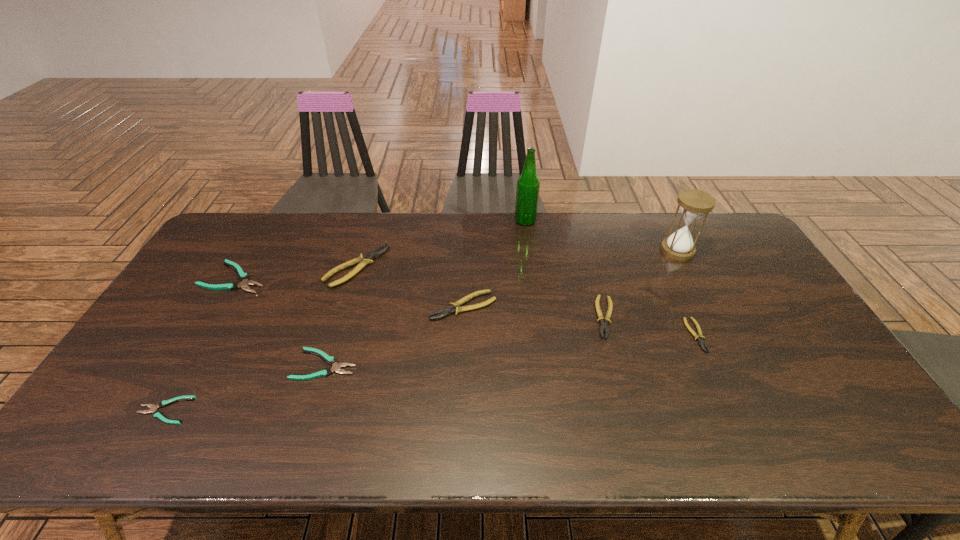
Locate which pliers ranks fourth in proximity to the hourglass. Please provide its 2D coordinates. Your answer should be formatted as a tuple, i.e. [(x, y)], where the tuple contains the x and y coordinates of a point satisfying the conditions above.

[(363, 260)]

You are a GUI agent. You are given a task and a screenshot of the screen. Output one action in this format:
    pyautogui.click(x=<x>, y=<y>)
    Task: Click on the pliers object that ranks as the fifth closest to the shortest object
    Image resolution: width=960 pixels, height=540 pixels.
    Given the screenshot: What is the action you would take?
    pyautogui.click(x=603, y=325)

Image resolution: width=960 pixels, height=540 pixels. In order to click on the fourth closest yellow pliers relative to the biggest teal pliers in this screenshot , I will do `click(699, 337)`.

In order to click on yellow pliers that can be found as the fourth closest to the hourglass in this screenshot , I will do `click(363, 260)`.

Identify which teal pliers is the nearest to the rightmost pliers. Please provide its 2D coordinates. Your answer should be formatted as a tuple, i.e. [(x, y)], where the tuple contains the x and y coordinates of a point satisfying the conditions above.

[(336, 367)]

This screenshot has width=960, height=540. I want to click on teal pliers that is the closest one to the rightmost yellow pliers, so click(336, 367).

The image size is (960, 540). Find the location of `free space that satisfies the following two spatial constraints: 1. on the back side of the eighth shortest object; 2. on the left side of the rightmost pliers`. free space that satisfies the following two spatial constraints: 1. on the back side of the eighth shortest object; 2. on the left side of the rightmost pliers is located at coordinates (657, 250).

I want to click on vacant point that satisfies the following two spatial constraints: 1. on the back side of the rightmost pliers; 2. on the label of the green beer bottle, so click(x=643, y=221).

Find the location of a particular element. free space that satisfies the following two spatial constraints: 1. on the back side of the shortest object; 2. on the right side of the third pliers from right to left is located at coordinates coord(225,306).